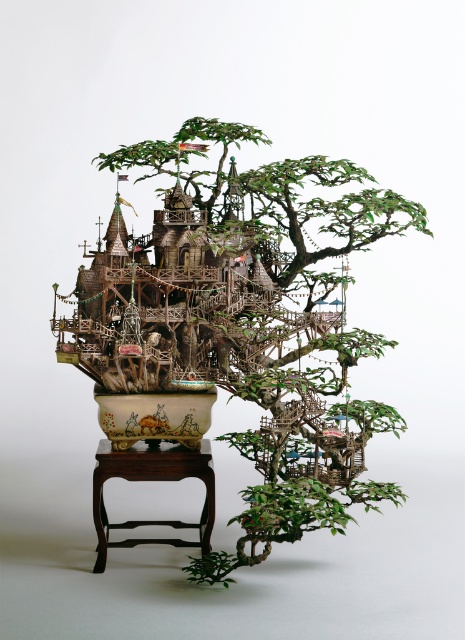
Which of these two, green matte tree at center or brown wood stool at lower center, stands taller?

green matte tree at center

Is green matte tree at center shorter than brown wood stool at lower center?

No.

Who is more distant from viewer, (79, 346) or (113, 524)?

The point (113, 524) is behind.

The image size is (465, 640). Find the location of `green matte tree at center`. green matte tree at center is located at coordinates (238, 316).